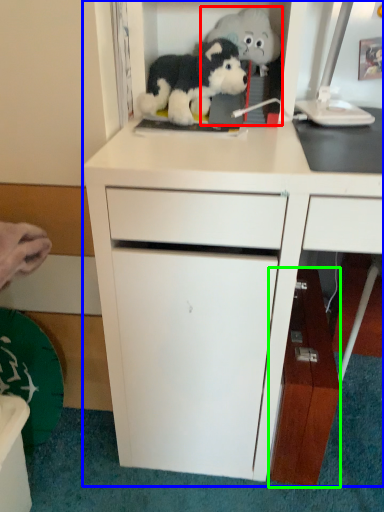
Question: Which is nearer to the toy (highlighted by a red box)? cabinetry (highlighted by a blue box) or cabinetry (highlighted by a green box).

Choices:
 (A) cabinetry
 (B) cabinetry

Answer: (A)